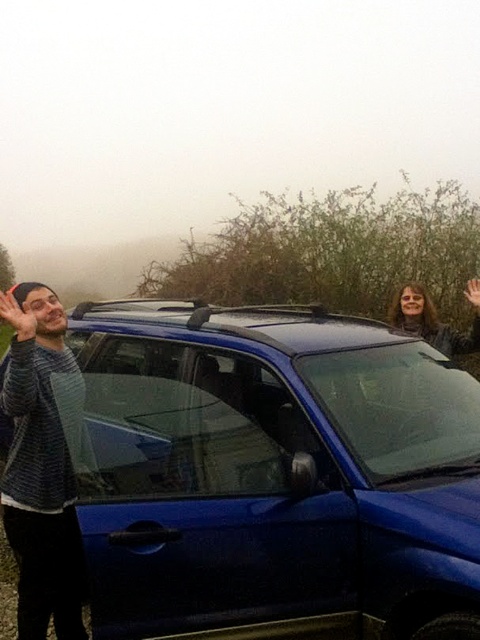
Which of these two, blue glossy suv at center or striped sweater at left, stands taller?

Standing taller between the two is striped sweater at left.

Is blue glossy suv at center shorter than striped sweater at left?

Yes, blue glossy suv at center is shorter than striped sweater at left.

Between point (215, 593) and point (68, 371), which one is positioned behind?

Positioned behind is point (68, 371).

Where is `blue glossy suv at center`? This screenshot has width=480, height=640. blue glossy suv at center is located at coordinates (273, 474).

Does point (384, 556) lie in front of point (470, 304)?

Yes, point (384, 556) is in front of point (470, 304).

Is blue glossy suv at center to the right of matte black hand at upper right from the viewer's perspective?

No, blue glossy suv at center is not to the right of matte black hand at upper right.

You are a GUI agent. You are given a task and a screenshot of the screen. Output one action in this format:
    pyautogui.click(x=<x>, y=<y>)
    Task: Click on the blue glossy suv at center
    
    Given the screenshot: What is the action you would take?
    pyautogui.click(x=273, y=474)

Between matte black hand at upper left and matte black hand at upper right, which one is positioned lower?

matte black hand at upper left

What do you see at coordinates (16, 316) in the screenshot? I see `matte black hand at upper left` at bounding box center [16, 316].

Where is `matte black hand at upper left`? The image size is (480, 640). matte black hand at upper left is located at coordinates (16, 316).